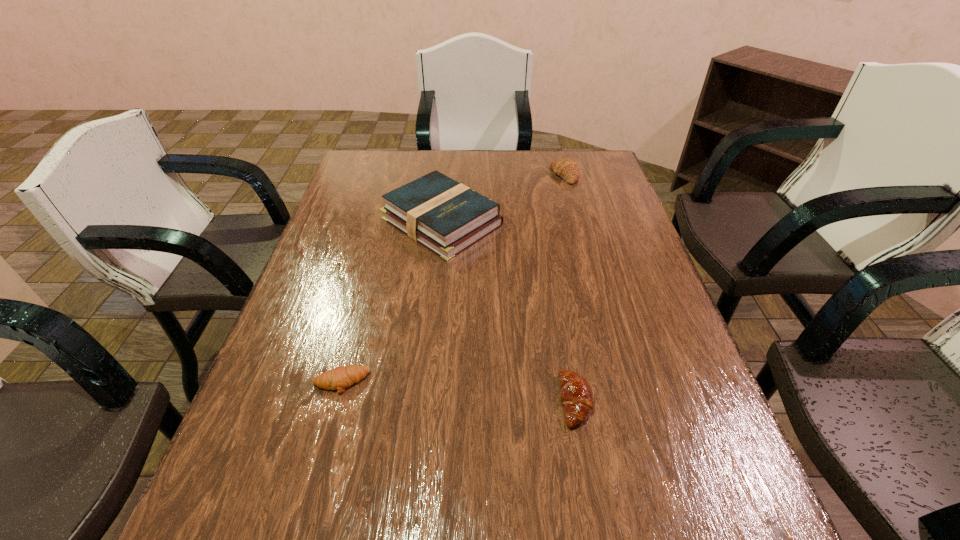
Find the location of a particular element. blank region between the shortest object and the farthest object is located at coordinates (x=453, y=279).

Locate an element on the screen. The width and height of the screenshot is (960, 540). object identified as the second closest to the third tallest object is located at coordinates coord(339,378).

Point out which object is positioned as the second nearest to the shortest object. Please provide its 2D coordinates. Your answer should be formatted as a tuple, i.e. [(x, y)], where the tuple contains the x and y coordinates of a point satisfying the conditions above.

[(576, 394)]

Find the location of a particular element. Image resolution: width=960 pixels, height=540 pixels. the second closest crescent roll to the second shortest crescent roll is located at coordinates (566, 168).

Identify the location of the third closest crescent roll to the hardback book. (576, 394).